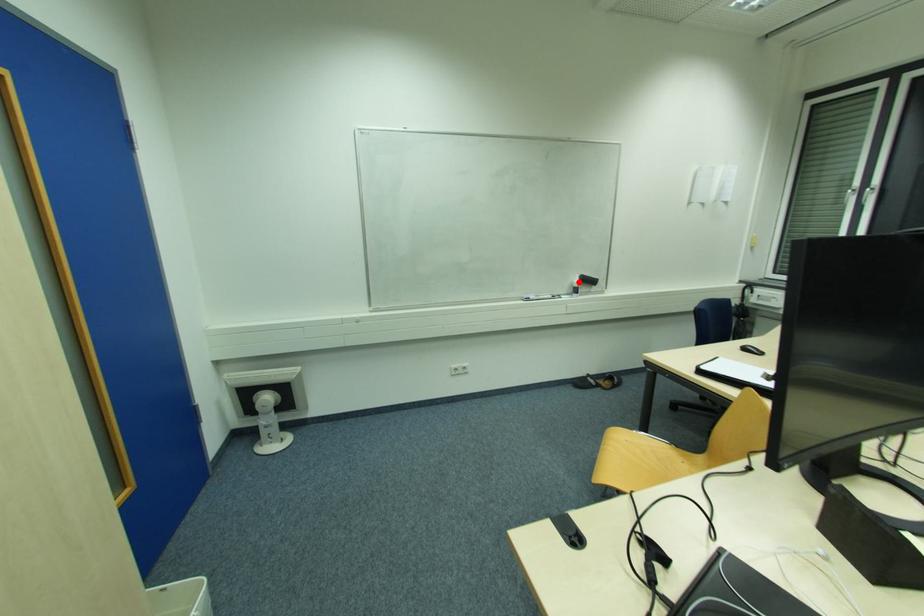
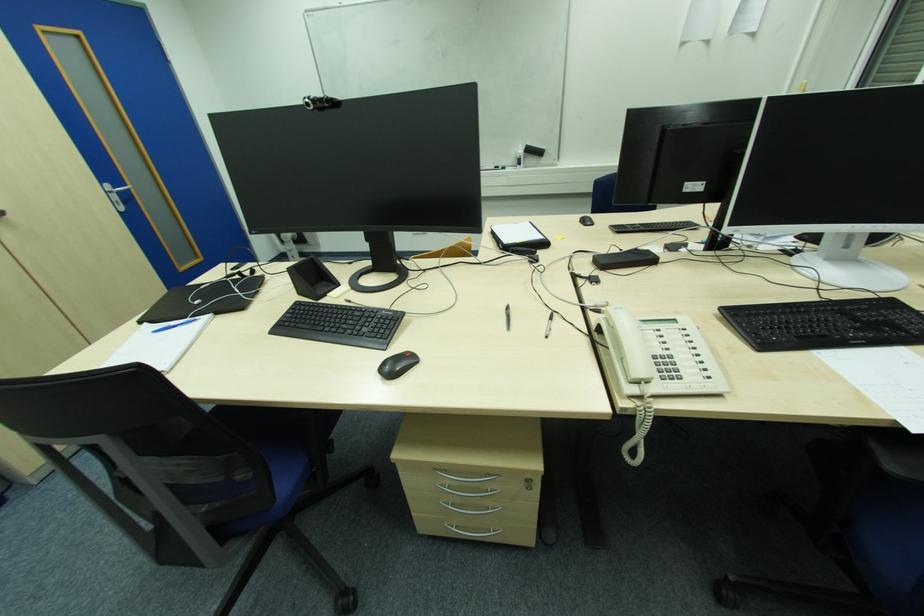
Where in the second image is the point corresponding to the highlighted location from the first image?

(521, 153)